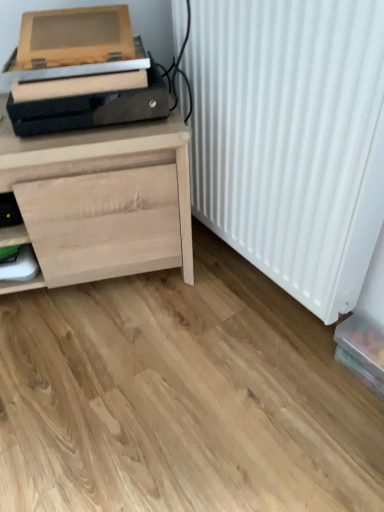
Question: In the image, is natural wood chest of drawers at left on the left side or the right side of white matte radiator at right?

Choices:
 (A) right
 (B) left

Answer: (B)

Question: From the image's perspective, relative to white matte radiator at right, is natural wood chest of drawers at left above or below?

Choices:
 (A) below
 (B) above

Answer: (A)

Question: Which object is the closest to the translucent plastic box at lower right?

Choices:
 (A) white matte radiator at right
 (B) wooden printer at upper left
 (C) natural wood chest of drawers at left

Answer: (A)

Question: Considering the real-world distances, which object is closest to the wooden printer at upper left?

Choices:
 (A) natural wood chest of drawers at left
 (B) translucent plastic box at lower right
 (C) white matte radiator at right

Answer: (A)